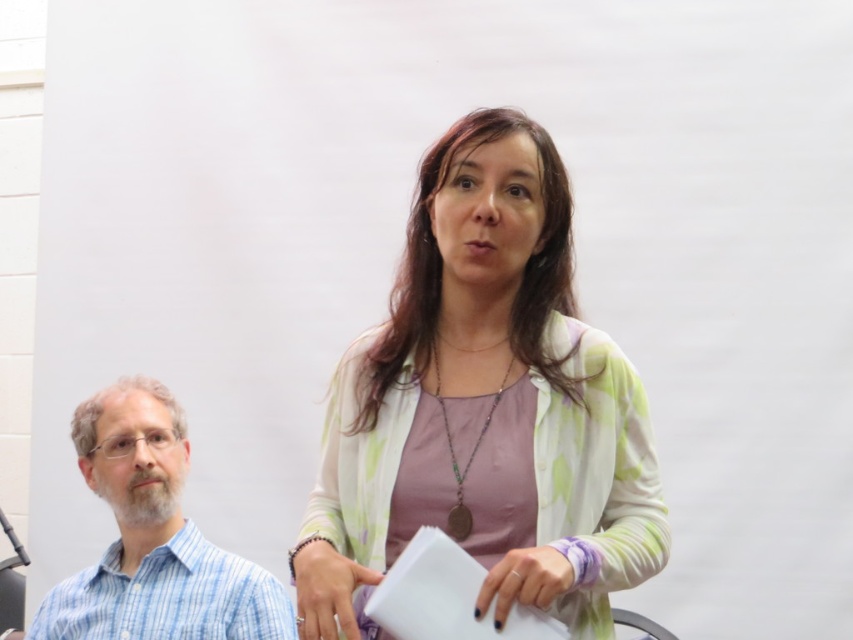
Is point (480, 301) positioned behind point (155, 412)?

No, it is not.

Is pastel floral cardigan at center above blue striped shirt at left?

Yes, pastel floral cardigan at center is above blue striped shirt at left.

Is point (363, 500) in front of point (219, 577)?

That is True.

What are the coordinates of `pastel floral cardigan at center` in the screenshot? It's located at (485, 406).